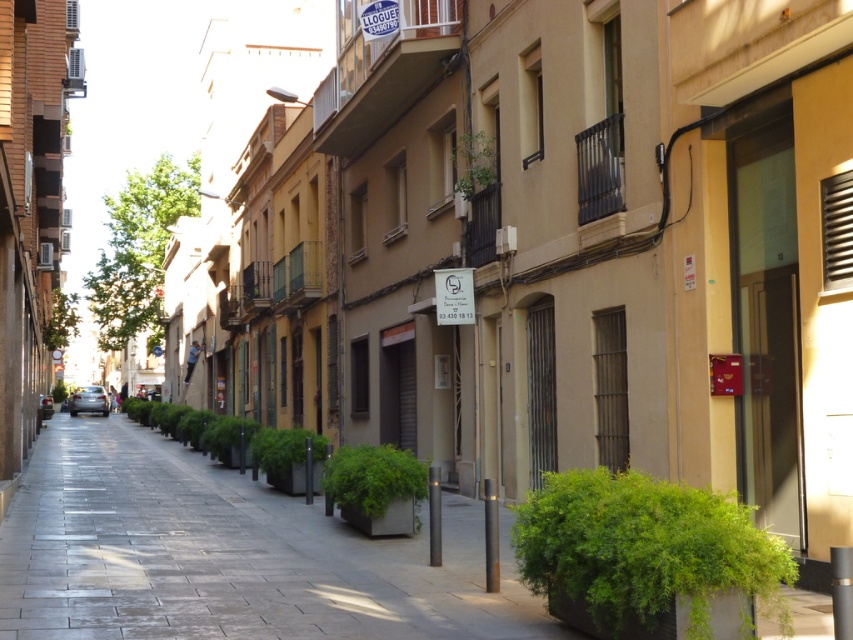
Question: Which point is farther from the camera taking this photo?

Choices:
 (A) (379, 449)
 (B) (695, 502)
 (C) (482, 164)

Answer: (C)

Question: Does green leafy plant at center appear over green leafy plant at upper center?

Choices:
 (A) yes
 (B) no

Answer: (B)

Question: Can you confirm if green leafy plant at center is bigger than green leafy planter at center?

Choices:
 (A) no
 (B) yes

Answer: (B)

Question: Does green leafy planter at center have a lesser width compared to green leafy plant at upper center?

Choices:
 (A) no
 (B) yes

Answer: (A)

Question: Which point is farther to the camera?

Choices:
 (A) (756, 540)
 (B) (416, 496)
 (C) (465, 173)

Answer: (C)

Question: Which object appears closest to the camera in this image?

Choices:
 (A) green leafy plant at center
 (B) green leafy plant at upper center
 (C) green leafy planter at center

Answer: (A)